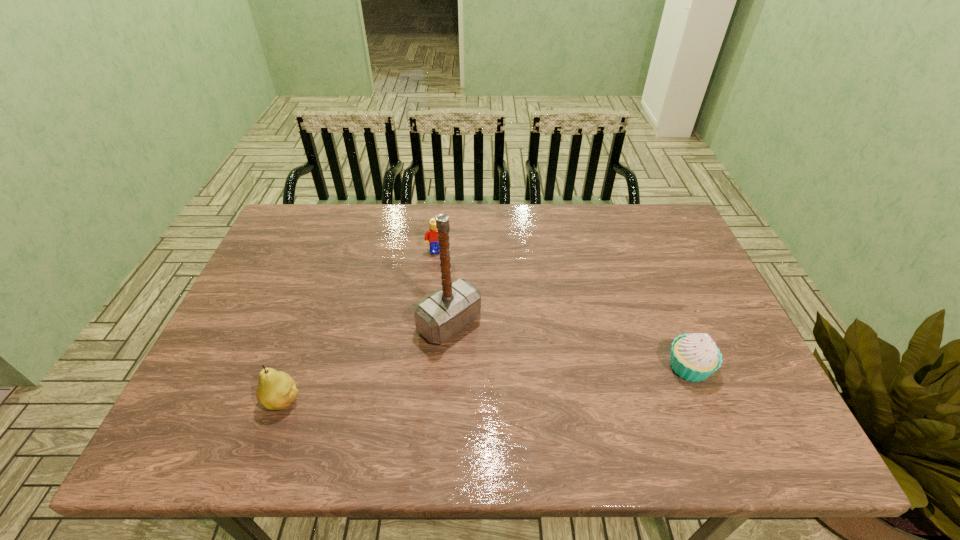
What are the coordinates of `pear` in the screenshot? It's located at (276, 390).

The width and height of the screenshot is (960, 540). I want to click on cupcake, so click(694, 357).

The image size is (960, 540). In order to click on Lego in this screenshot , I will do `click(431, 234)`.

Locate an element on the screen. Image resolution: width=960 pixels, height=540 pixels. the tallest object is located at coordinates (445, 312).

This screenshot has width=960, height=540. What are the coordinates of `hammer` in the screenshot? It's located at (445, 312).

Identify the location of vacant region located 0.070m on the back of the leftmost object. The image size is (960, 540). (299, 359).

Locate an element on the screen. The width and height of the screenshot is (960, 540). free location located on the back of the rightmost object is located at coordinates (672, 326).

Find the location of `free space located on the front-facing side of the farthest object`. free space located on the front-facing side of the farthest object is located at coordinates (446, 288).

Find the location of a particular element. The image size is (960, 540). vacant space located 0.160m on the front-facing side of the farthest object is located at coordinates (448, 293).

Image resolution: width=960 pixels, height=540 pixels. In order to click on vacant space located 0.260m on the front-facing side of the farthest object in this screenshot , I will do `click(454, 320)`.